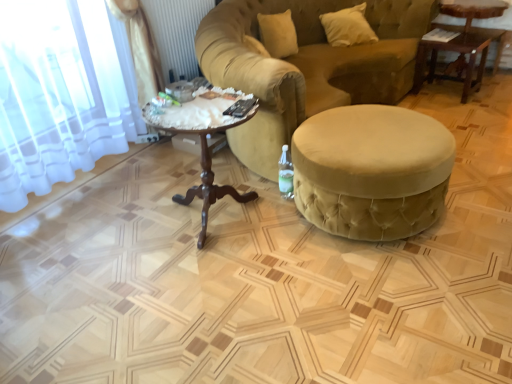
You are a GUI agent. You are given a task and a screenshot of the screen. Output one action in this format:
    pyautogui.click(x=<x>, y=<y>)
    Task: Click on the vacant area that lies between mahogany wood coffee table at center and velvet yellow studio couch at center
    
    Given the screenshot: What is the action you would take?
    pyautogui.click(x=162, y=187)